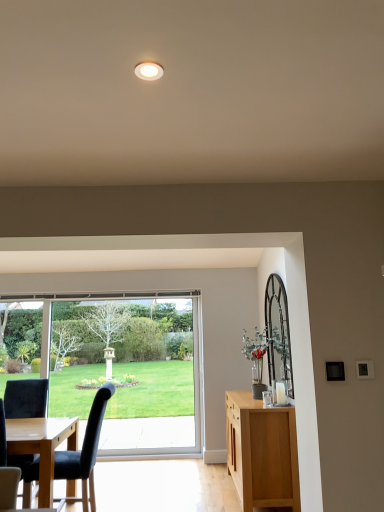
Question: Considering the positions of black leather chair at lower left, which ranks as the first chair in left-to-right order, and green leafy plant in glass vase at right in the image, is black leather chair at lower left, which ranks as the first chair in left-to-right order, wider or thinner than green leafy plant in glass vase at right?

Choices:
 (A) thin
 (B) wide

Answer: (B)

Question: Would you say black leather chair at lower left, which ranks as the first chair in left-to-right order, is to the left or to the right of green leafy plant in glass vase at right in the picture?

Choices:
 (A) left
 (B) right

Answer: (A)

Question: Estimate the real-world distances between objects in this image. Which object is closer to the white glossy light fixture at upper center?

Choices:
 (A) light brown wood cabinet at right
 (B) black fabric chair at left, positioned as the second chair in left-to-right order
 (C) green leafy plant in glass vase at right
 (D) black leather chair at lower left, placed as the second chair when sorted from right to left
 (E) clear glass window at center

Answer: (D)

Question: Estimate the real-world distances between objects in this image. Which object is farther from the black leather chair at lower left, placed as the second chair when sorted from right to left?

Choices:
 (A) green leafy plant in glass vase at right
 (B) light brown wood cabinet at right
 (C) black fabric chair at left, positioned as the second chair in left-to-right order
 (D) clear glass window at center
 (E) white glossy light fixture at upper center

Answer: (E)